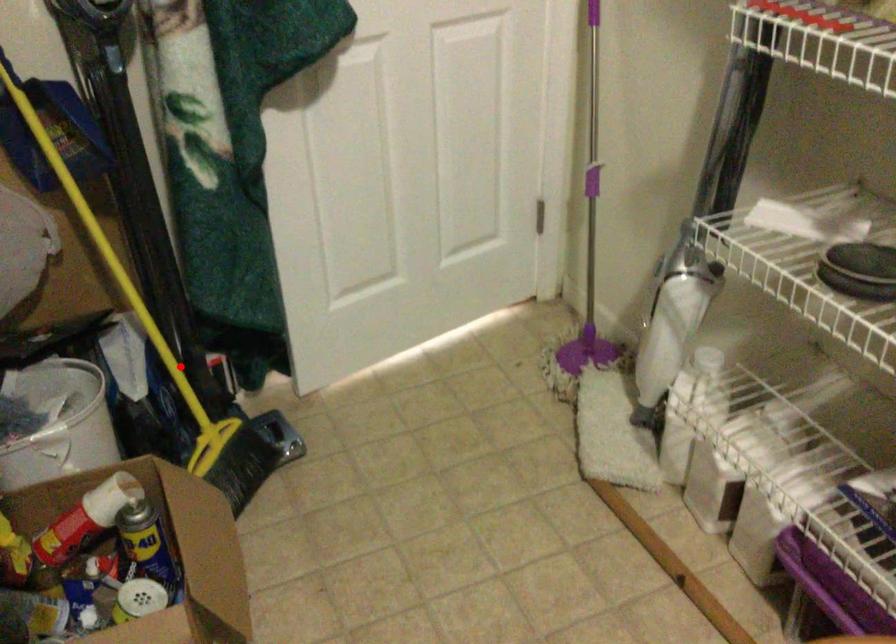
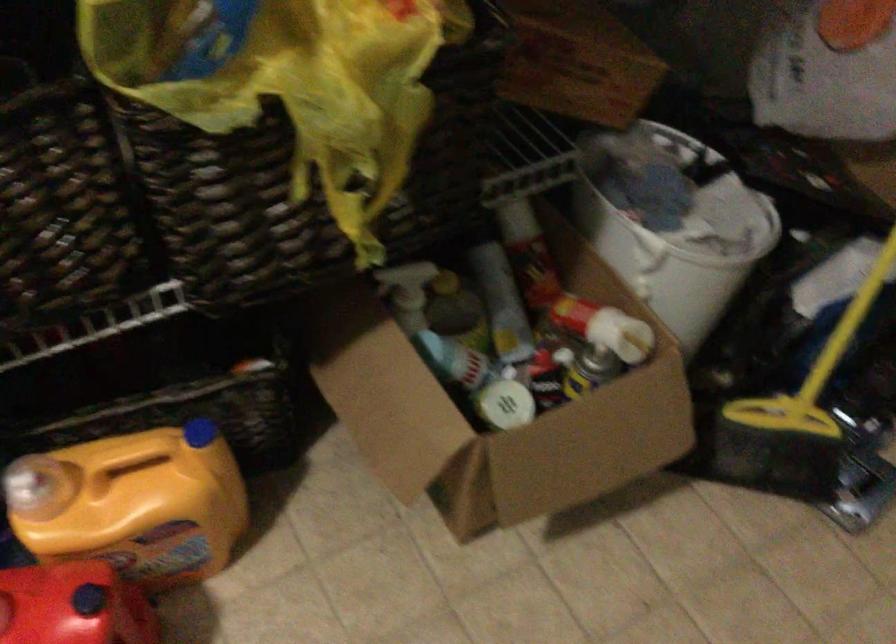
Question: I am providing you with two images of the same scene from different viewpoints. Given a red point in image1, look at the same physical point in image2. Is it:

Choices:
 (A) Closer to the viewpoint
 (B) Farther from the viewpoint

Answer: (A)